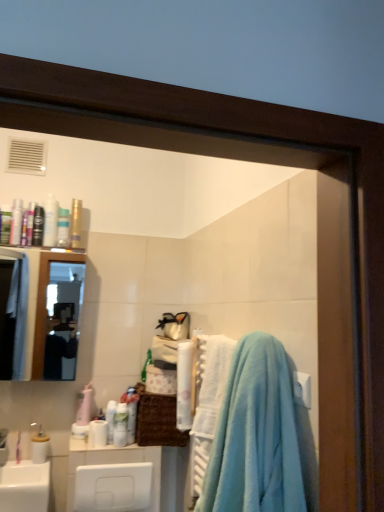
Question: Considering the positions of gold metallic spray can at upper left, which is counted as the third toiletry, starting from the right, and matte white spray can at upper left, the 4th toiletry in the right-to-left sequence, in the image, is gold metallic spray can at upper left, which is counted as the third toiletry, starting from the right, taller or shorter than matte white spray can at upper left, the 4th toiletry in the right-to-left sequence,?

Choices:
 (A) short
 (B) tall

Answer: (B)

Question: Would you say gold metallic spray can at upper left, which is counted as the third toiletry, starting from the right, is to the left or to the right of matte white spray can at upper left, the 4th toiletry in the right-to-left sequence, in the picture?

Choices:
 (A) left
 (B) right

Answer: (B)

Question: Which of these objects is positioned farthest from the white fluffy bath towel at center?

Choices:
 (A) clear glass mirror at upper left
 (B) matte black hair spray at upper left, the 9th toiletry viewed from the right
 (C) white glossy bottle at center, positioned as the ninth toiletry in left-to-right order
 (D) light blue plush towel at right
 (E) white plastic towel bar at upper right

Answer: (A)

Question: Considering the real-world distances, which object is farthest from the white glossy spray can at upper left, the eighth toiletry when ordered from right to left?

Choices:
 (A) gold metallic spray can at upper left, positioned as the seventh toiletry in left-to-right order
 (B) matte white spray can at upper left, the 4th toiletry in the right-to-left sequence
 (C) white fluffy bath towel at center
 (D) shiny black tube at upper left, which ranks as the 6th toiletry in right-to-left order
 (E) white glossy sink at lower left

Answer: (C)